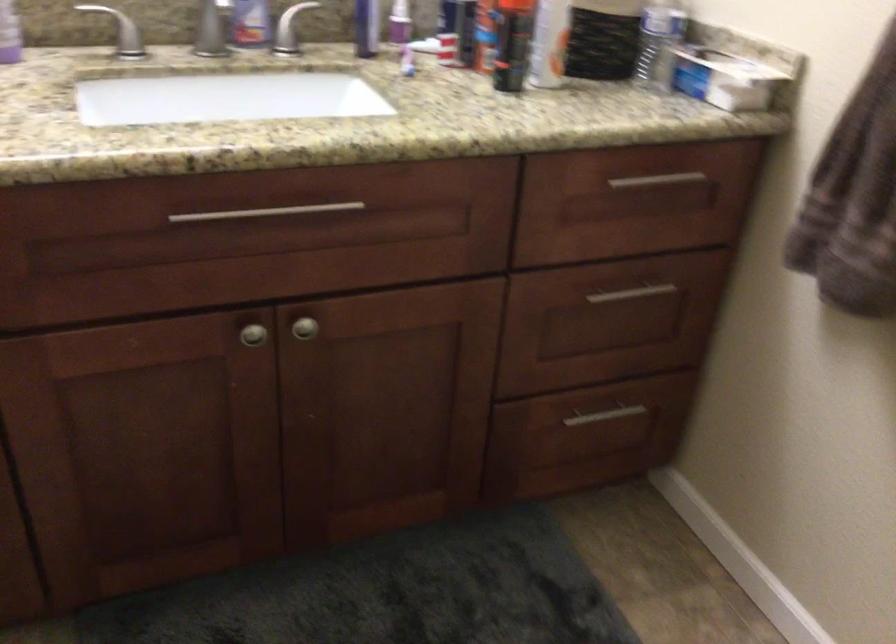
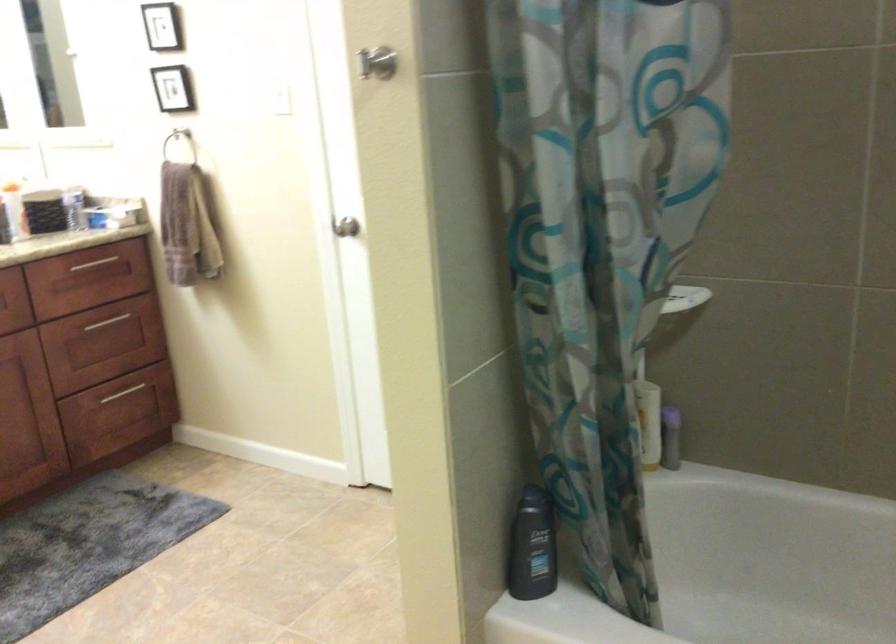
In the second image, find the point that corresponds to pixel 629 305 in the first image.

(115, 323)